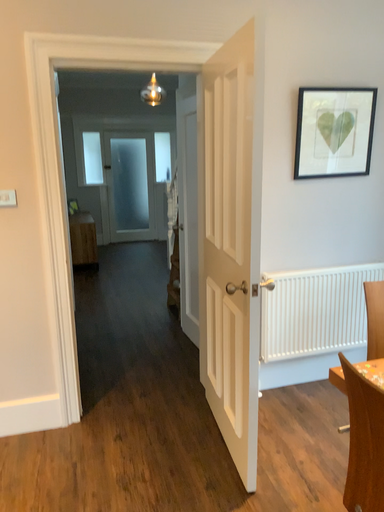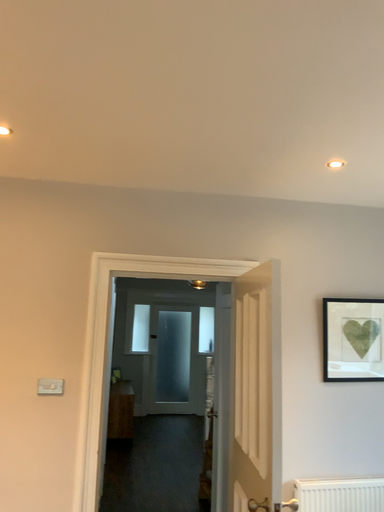
Question: How did the camera likely rotate when shooting the video?

Choices:
 (A) rotated upward
 (B) rotated downward

Answer: (A)